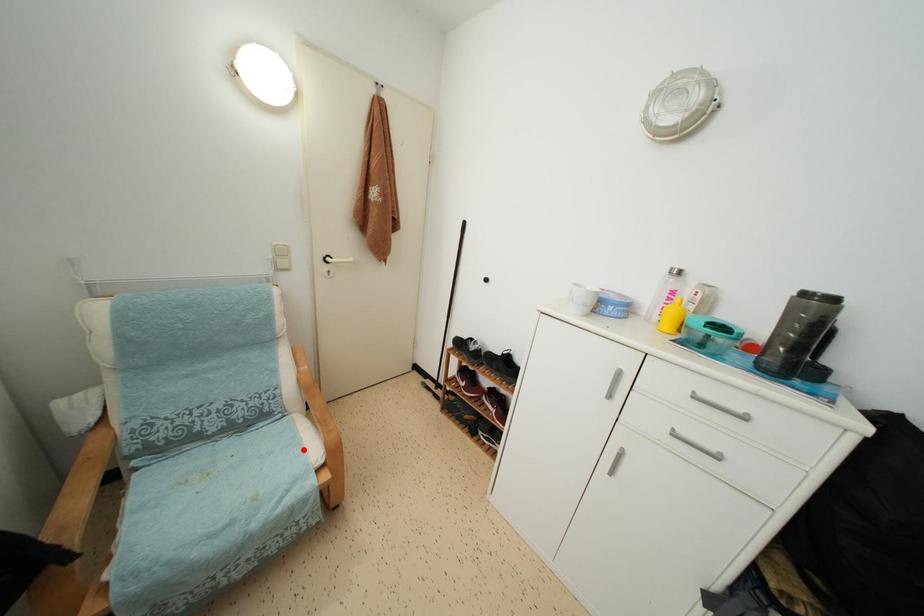
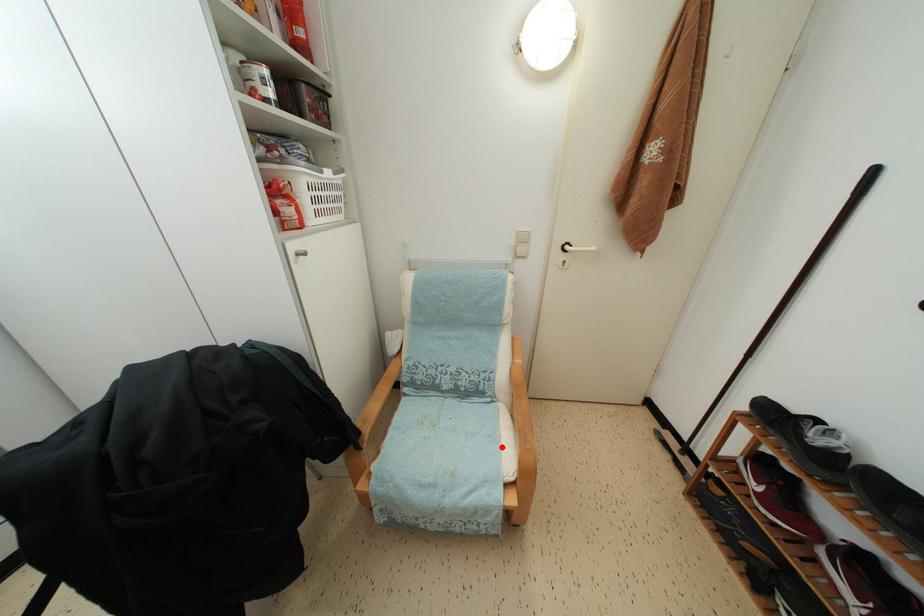
I am providing you with two images of the same scene from different viewpoints. A red point is marked on the first image and another point is marked on the second image. Is the marked point in image1 the same physical position as the marked point in image2?

Yes